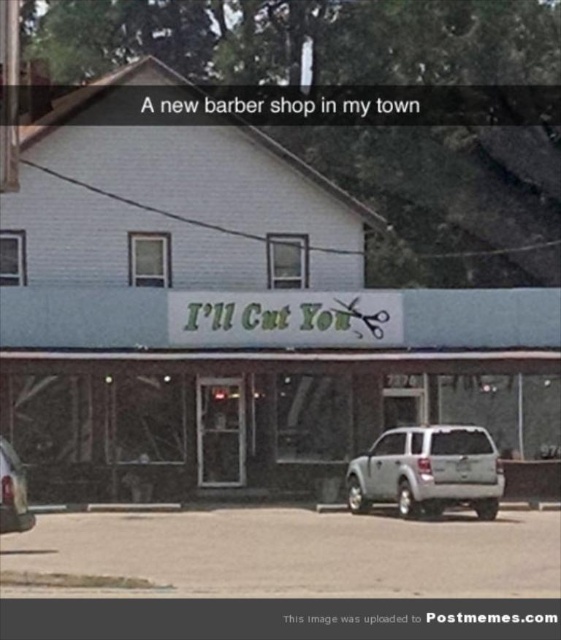
You are standing at the entrance of the building and want to see the green cursive sign above the entrance. Is the satin silver suv at center blocking your view?

The satin silver suv at center is parked at point (427, 472), which is in front of the building entrance. Since the SUV is parked in front of the entrance, it may block the view of the green cursive sign above the entrance depending on its height and positioning. However, the sign is mounted above the entrance, so if the SUV is not too tall, the sign should still be visible above it.

You are standing in front of the building and want to walk towards the entrance. There are two points marked on the ground in front of the building. The first point is at coordinates point (155,474) and the second point is at point (360,499). Which point is closer to you?

Point (155,474) is further to the camera than point (360,499), so the closer point to you is point (360,499).